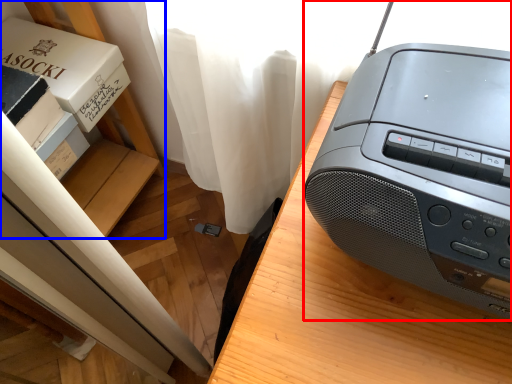
Question: Which of the following is the closest to the observer, printer (highlighted by a red box) or shelf (highlighted by a blue box)?

Choices:
 (A) printer
 (B) shelf

Answer: (A)